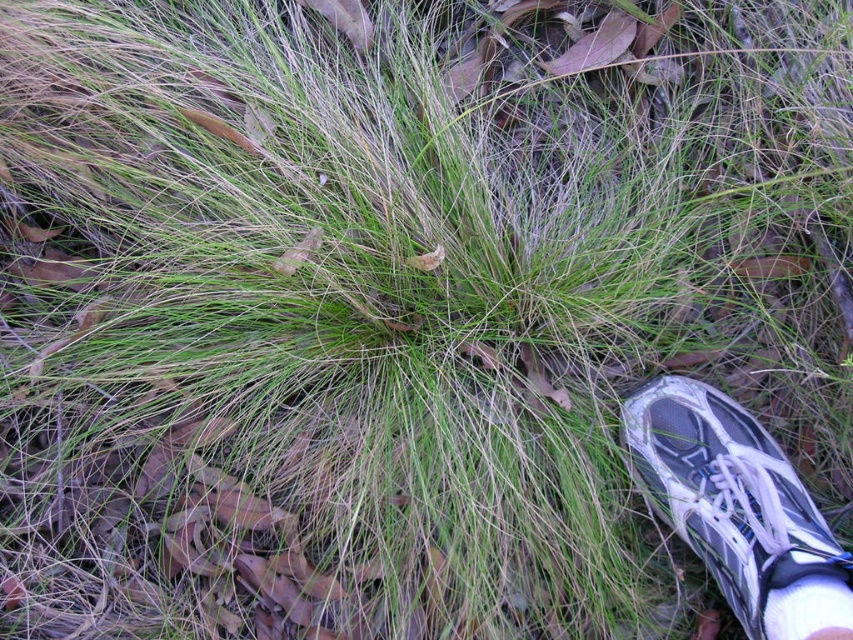
Question: Is white mesh shoe at lower right bigger than white fabric sock at lower right?

Choices:
 (A) no
 (B) yes

Answer: (B)

Question: Which point is closer to the camera taking this photo?

Choices:
 (A) (692, 536)
 (B) (846, 588)

Answer: (B)

Question: Which point appears closest to the camera in this image?

Choices:
 (A) (682, 420)
 (B) (776, 592)

Answer: (B)

Question: Can you confirm if white mesh shoe at lower right is bigger than white fabric sock at lower right?

Choices:
 (A) no
 (B) yes

Answer: (B)

Question: Which of the following is the farthest from the observer?

Choices:
 (A) white fabric sock at lower right
 (B) white mesh shoe at lower right

Answer: (B)

Question: Is white mesh shoe at lower right positioned in front of white fabric sock at lower right?

Choices:
 (A) yes
 (B) no

Answer: (B)